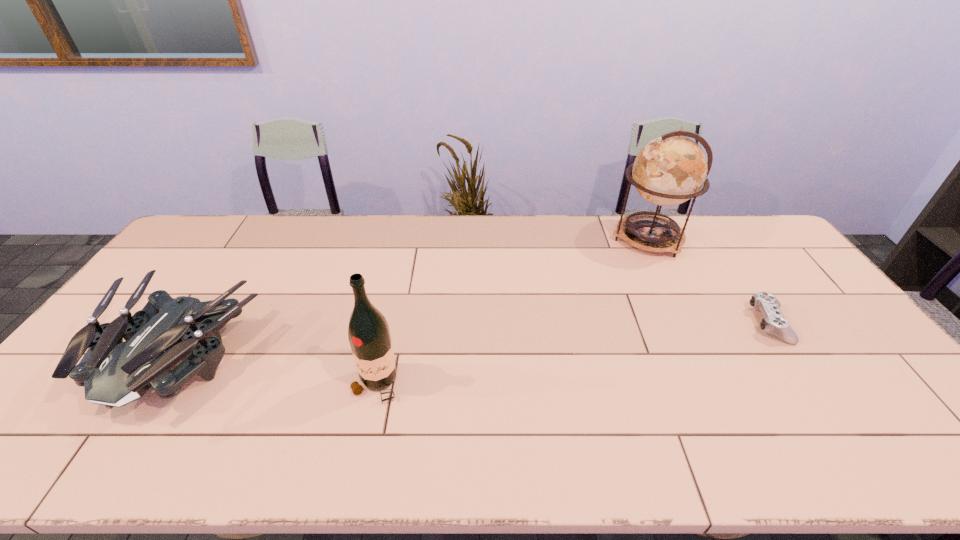
Find the location of a particular element. The height and width of the screenshot is (540, 960). the tallest object is located at coordinates (669, 170).

Find the location of a particular element. the third object from left to right is located at coordinates (669, 170).

You are a GUI agent. You are given a task and a screenshot of the screen. Output one action in this format:
    pyautogui.click(x=<x>, y=<y>)
    Task: Click on the wine bottle
    
    Given the screenshot: What is the action you would take?
    pyautogui.click(x=368, y=332)

I want to click on the third object from right to left, so click(368, 332).

Locate an element on the screen. The height and width of the screenshot is (540, 960). the second shortest object is located at coordinates (114, 373).

Locate an element on the screen. The image size is (960, 540). drone is located at coordinates (114, 373).

This screenshot has height=540, width=960. I want to click on the rightmost object, so click(x=773, y=322).

The height and width of the screenshot is (540, 960). What are the coordinates of `control` in the screenshot? It's located at (773, 322).

Identify the location of vacant region located 0.400m at the center of the third object from left to right. This screenshot has height=540, width=960. (499, 238).

I want to click on vacant region located 0.060m at the center of the third object from left to right, so click(593, 238).